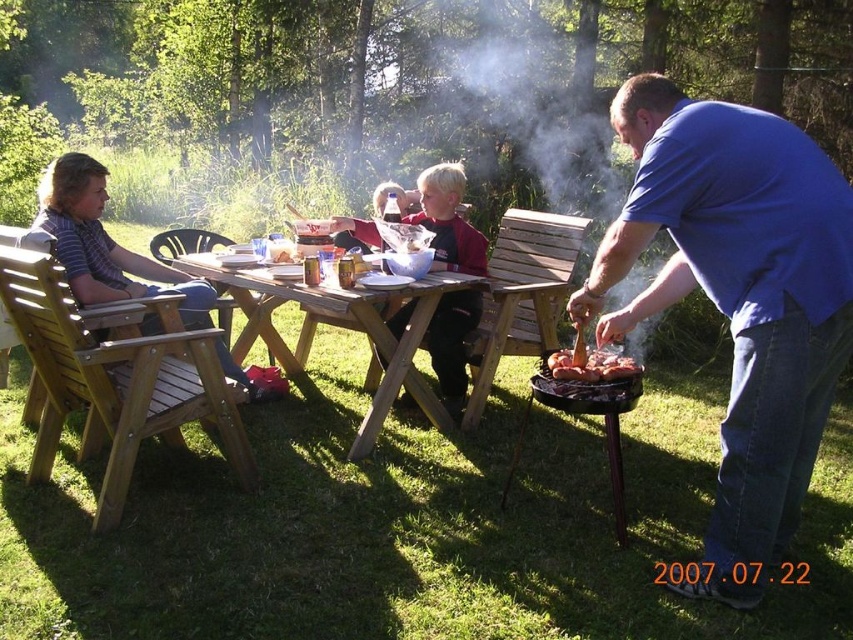
Question: Is dark blue shirt at center further to camera compared to grilled meat at right?

Choices:
 (A) no
 (B) yes

Answer: (B)

Question: Can you confirm if dark blue shirt at center is positioned above grilled meat at right?

Choices:
 (A) no
 (B) yes

Answer: (B)

Question: Which of these objects is positioned closest to the wooden picnic table at center?

Choices:
 (A) grilled meat at right
 (B) striped cotton shirt at left

Answer: (B)

Question: Which point is closer to the camera?

Choices:
 (A) dark blue shirt at center
 (B) grilled meat at right

Answer: (B)

Question: Is blue cotton shirt at right smaller than wooden picnic table at center?

Choices:
 (A) yes
 (B) no

Answer: (A)

Question: Which point appears farthest from the camera in this image?

Choices:
 (A) (630, 356)
 (B) (785, 259)

Answer: (A)